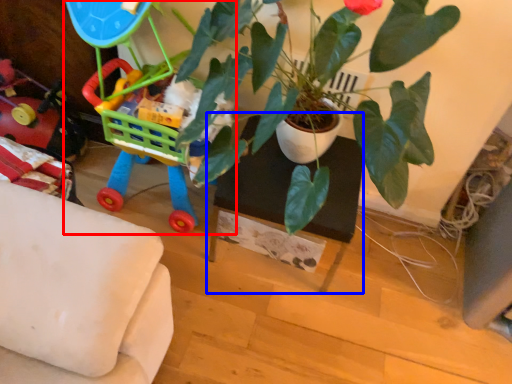
Question: Which of the following is the farthest to the observer, toy (highlighted by a red box) or table (highlighted by a blue box)?

Choices:
 (A) toy
 (B) table

Answer: (B)